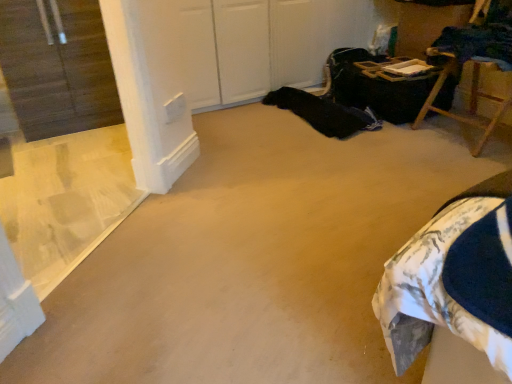
Find the location of a particular element. This screenshot has width=512, height=384. transparent plastic window at left is located at coordinates point(62,140).

What do you see at coordinates (62, 140) in the screenshot? This screenshot has width=512, height=384. I see `transparent plastic window at left` at bounding box center [62, 140].

This screenshot has height=384, width=512. What are the coordinates of `wooden folding chair at upper right` in the screenshot? It's located at (471, 89).

What do you see at coordinates (471, 89) in the screenshot?
I see `wooden folding chair at upper right` at bounding box center [471, 89].

You are a GUI agent. You are given a task and a screenshot of the screen. Output one action in this format:
    pyautogui.click(x=<x>, y=<y>)
    Task: Click on the transparent plastic window at left
    This screenshot has height=384, width=512.
    Given the screenshot: What is the action you would take?
    pyautogui.click(x=62, y=140)

Looking at this image, considering the relative positions of wooden folding chair at upper right and transparent plastic window at left in the image provided, is wooden folding chair at upper right to the right of transparent plastic window at left from the viewer's perspective?

Yes.

Consider the image. Relative to transparent plastic window at left, is wooden folding chair at upper right in front or behind?

Clearly, wooden folding chair at upper right is behind transparent plastic window at left.

Considering the positions of points (474, 27) and (75, 203), is point (474, 27) farther from camera compared to point (75, 203)?

Yes, point (474, 27) is behind point (75, 203).

From the image's perspective, between wooden folding chair at upper right and transparent plastic window at left, which one is located above?

wooden folding chair at upper right, from the image's perspective.

From a real-world perspective, which is physically above, wooden folding chair at upper right or transparent plastic window at left?

transparent plastic window at left is physically above.

Is wooden folding chair at upper right thinner than transparent plastic window at left?

No.

Is wooden folding chair at upper right taller or shorter than transparent plastic window at left?

wooden folding chair at upper right is shorter than transparent plastic window at left.

Is wooden folding chair at upper right bigger than transparent plastic window at left?

Correct, wooden folding chair at upper right is larger in size than transparent plastic window at left.

Is wooden folding chair at upper right inside or outside of transparent plastic window at left?

wooden folding chair at upper right is not enclosed by transparent plastic window at left.

Are wooden folding chair at upper right and transparent plastic window at left making contact?

They are not placed beside each other.

Is wooden folding chair at upper right positioned with its back to transparent plastic window at left?

No, wooden folding chair at upper right is not facing away from transparent plastic window at left.

How different are the orientations of wooden folding chair at upper right and transparent plastic window at left in degrees?

134 degrees separate the facing orientations of wooden folding chair at upper right and transparent plastic window at left.

Measure the distance between wooden folding chair at upper right and transparent plastic window at left.

They are 6.23 feet apart.

Find the location of a particular element. This screenshot has height=384, width=512. window above the wooden folding chair at upper right (from a real-world perspective) is located at coordinates (62, 140).

Is transparent plastic window at left at the left side of wooden folding chair at upper right?

Correct, you'll find transparent plastic window at left to the left of wooden folding chair at upper right.

Is transparent plastic window at left closer to the viewer compared to wooden folding chair at upper right?

Yes, transparent plastic window at left is closer to the viewer.

Is point (17, 62) behind point (429, 52)?

No, (17, 62) is closer to viewer.

From the image's perspective, between transparent plastic window at left and wooden folding chair at upper right, who is located below?

transparent plastic window at left.

From a real-world perspective, which object rests below the other?

From a 3D spatial view, wooden folding chair at upper right is below.

Considering the sizes of objects transparent plastic window at left and wooden folding chair at upper right in the image provided, who is thinner, transparent plastic window at left or wooden folding chair at upper right?

With smaller width is transparent plastic window at left.

Between transparent plastic window at left and wooden folding chair at upper right, which one has more height?

transparent plastic window at left is taller.

Considering the sizes of objects transparent plastic window at left and wooden folding chair at upper right in the image provided, who is bigger, transparent plastic window at left or wooden folding chair at upper right?

Bigger between the two is wooden folding chair at upper right.

Does transparent plastic window at left contain wooden folding chair at upper right?

That's incorrect, wooden folding chair at upper right is not inside transparent plastic window at left.

In the scene shown: Is transparent plastic window at left in contact with wooden folding chair at upper right?

No, transparent plastic window at left is not next to wooden folding chair at upper right.

Is transparent plastic window at left turned away from wooden folding chair at upper right?

No.

How different are the orientations of transparent plastic window at left and wooden folding chair at upper right in degrees?

The facing directions of transparent plastic window at left and wooden folding chair at upper right are 134 degrees apart.

Measure the distance between transparent plastic window at left and wooden folding chair at upper right.

transparent plastic window at left and wooden folding chair at upper right are 1.90 meters apart.

Find the location of a particular element. furniture behind the transparent plastic window at left is located at coordinates (471, 89).

In the image, there is a transparent plastic window at left. Where is `furniture below it (from a real-world perspective)`? furniture below it (from a real-world perspective) is located at coordinates (471, 89).

Image resolution: width=512 pixels, height=384 pixels. In the image, there is a transparent plastic window at left. Identify the location of furniture above it (from the image's perspective). (471, 89).